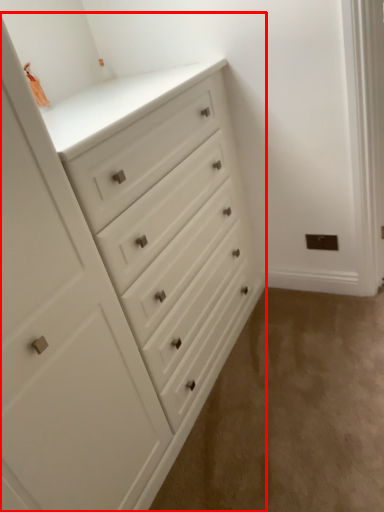
Question: Where is chest of drawers (annotated by the red box) located in relation to corridor in the image?

Choices:
 (A) left
 (B) right

Answer: (A)